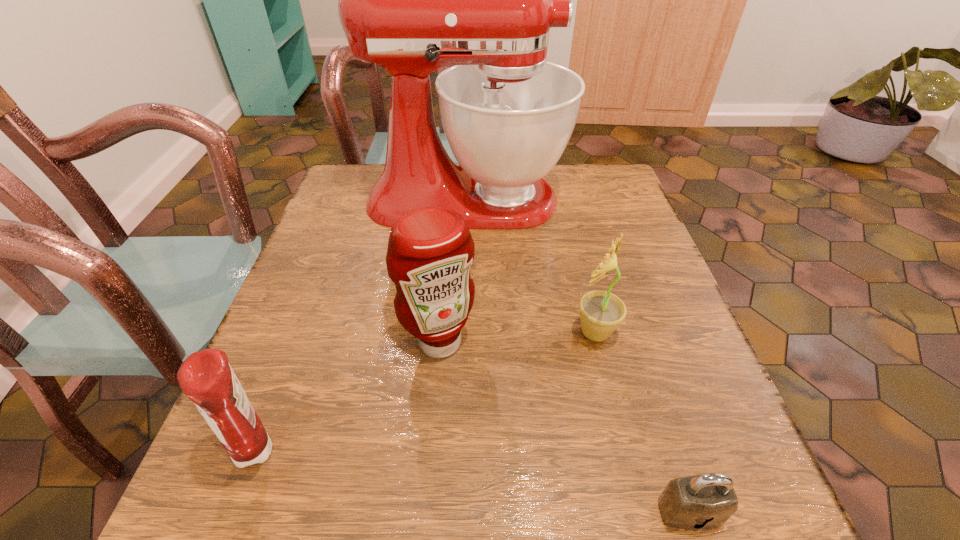
Locate an element on the screen. mixer that is at the right edge is located at coordinates (412, 0).

Where is `sunflower positioned at the right edge`? The height and width of the screenshot is (540, 960). sunflower positioned at the right edge is located at coordinates (601, 312).

Image resolution: width=960 pixels, height=540 pixels. I want to click on padlock that is at the right edge, so click(705, 501).

Image resolution: width=960 pixels, height=540 pixels. Find the location of `object that is at the far left corner`. object that is at the far left corner is located at coordinates (412, 0).

Where is `object that is at the near left corner`? The width and height of the screenshot is (960, 540). object that is at the near left corner is located at coordinates (206, 378).

I want to click on object present at the far right corner, so click(412, 0).

This screenshot has height=540, width=960. I want to click on object at the near right corner, so tap(705, 501).

At what (x,y) coordinates should I click in order to perform the action: click on vacant space at the far edge of the desktop. Please return your answer as a coordinate pair (x, y). Image resolution: width=960 pixels, height=540 pixels. Looking at the image, I should click on 558,187.

Identify the location of vacant point at the near edge. This screenshot has height=540, width=960. (441, 503).

The width and height of the screenshot is (960, 540). What are the coordinates of `free space at the left edge of the desktop` in the screenshot? It's located at (365, 304).